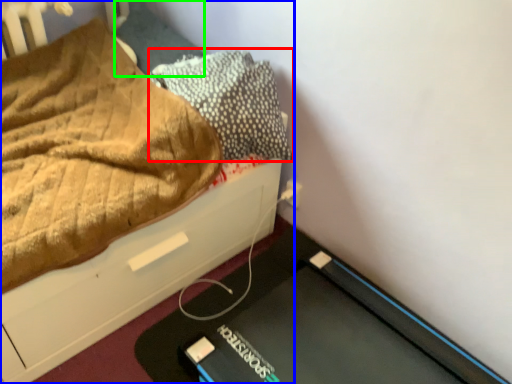
Question: Considering the real-world distances, which object is farthest from pillow (highlighted by a red box)? bed (highlighted by a blue box) or pillow (highlighted by a green box)?

Choices:
 (A) bed
 (B) pillow

Answer: (B)